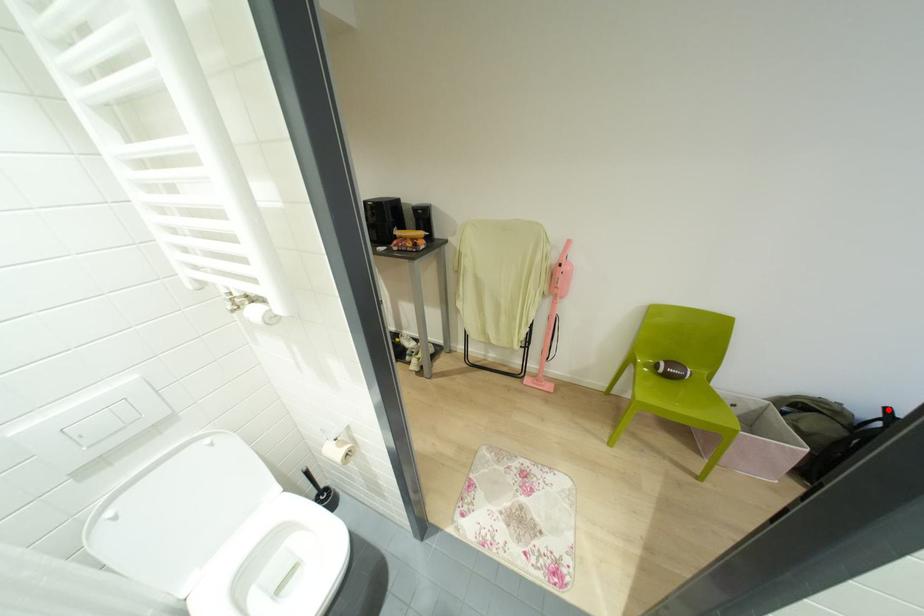
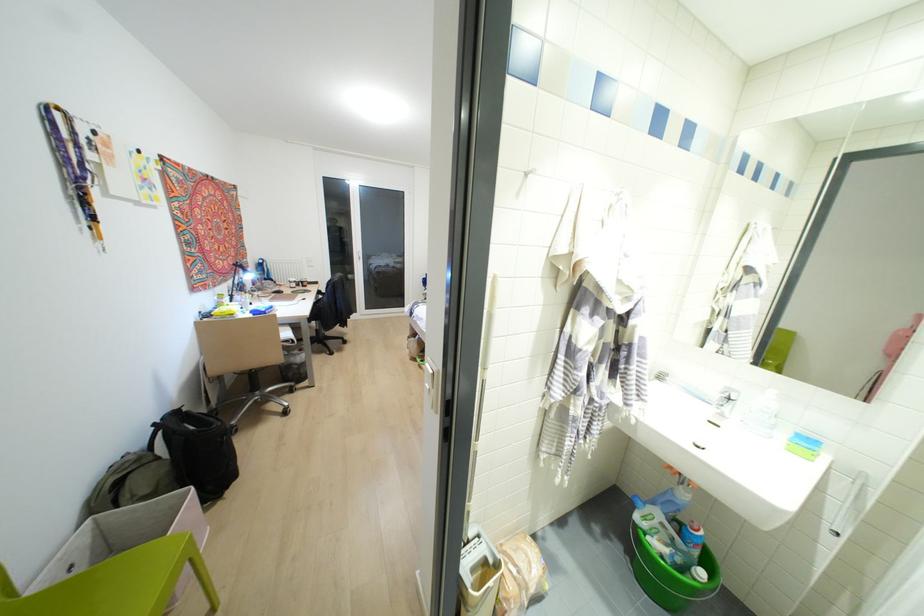
Question: A red point is marked in image1. In image2, is the corresponding 3D point closer to the camera or farther? Reply with the corresponding letter.

Choices:
 (A) The corresponding 3D point is closer.
 (B) The corresponding 3D point is farther.

Answer: (A)